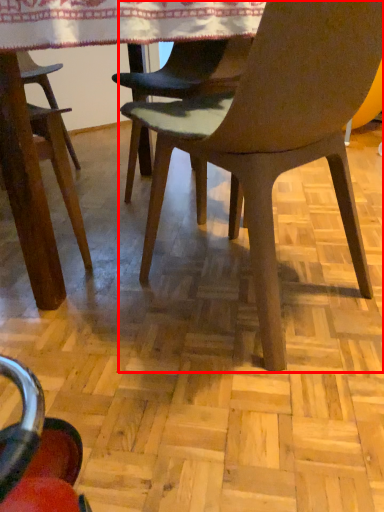
Question: Where is chair (annotated by the red box) located in relation to tablecloth in the image?

Choices:
 (A) left
 (B) right

Answer: (B)